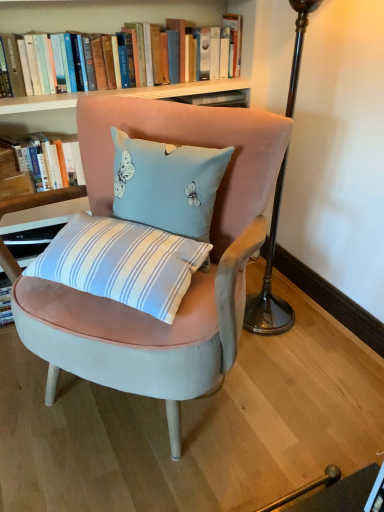
Locate an element on the screen. Image resolution: width=384 pixels, height=512 pixels. vacant area that is situated to the right of velvet pink chair at center is located at coordinates (311, 389).